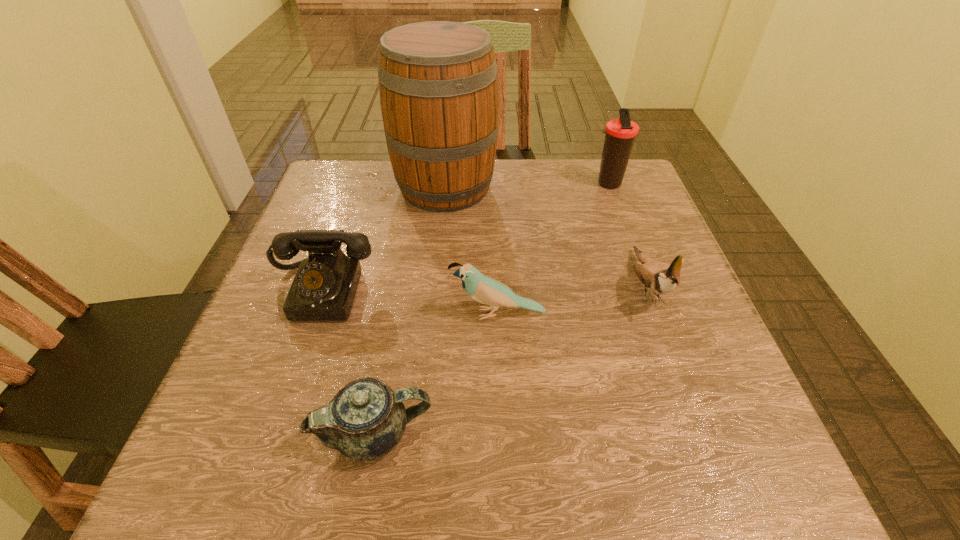
Where is `vacant area that lies between the left bird and the cider`? vacant area that lies between the left bird and the cider is located at coordinates (471, 251).

Find the location of a particular element. Image resolution: width=960 pixels, height=540 pixels. vacant space that's between the cider and the left bird is located at coordinates (471, 251).

At what (x,y) coordinates should I click in order to perform the action: click on free space between the thermos bottle and the telephone. Please return your answer as a coordinate pair (x, y). This screenshot has width=960, height=540. Looking at the image, I should click on (466, 238).

Identify the location of vacant space in between the right bird and the left bird. [x=572, y=299].

Find the location of a particular element. The image size is (960, 540). vacant point located between the second tallest object and the cider is located at coordinates (526, 185).

Identify the location of free space between the tallest object and the telephone. This screenshot has width=960, height=540. tap(384, 239).

Where is `free space between the telephone and the left bird`? The height and width of the screenshot is (540, 960). free space between the telephone and the left bird is located at coordinates (411, 302).

This screenshot has height=540, width=960. In order to click on free space between the telephone and the cider in this screenshot , I will do `click(384, 239)`.

Identify the location of unoccupied position between the thermos bottle and the right bird. Image resolution: width=960 pixels, height=540 pixels. (627, 234).

Identify which object is the third closest to the cider. Please provide its 2D coordinates. Your answer should be formatted as a tuple, i.e. [(x, y)], where the tuple contains the x and y coordinates of a point satisfying the conditions above.

[(484, 289)]